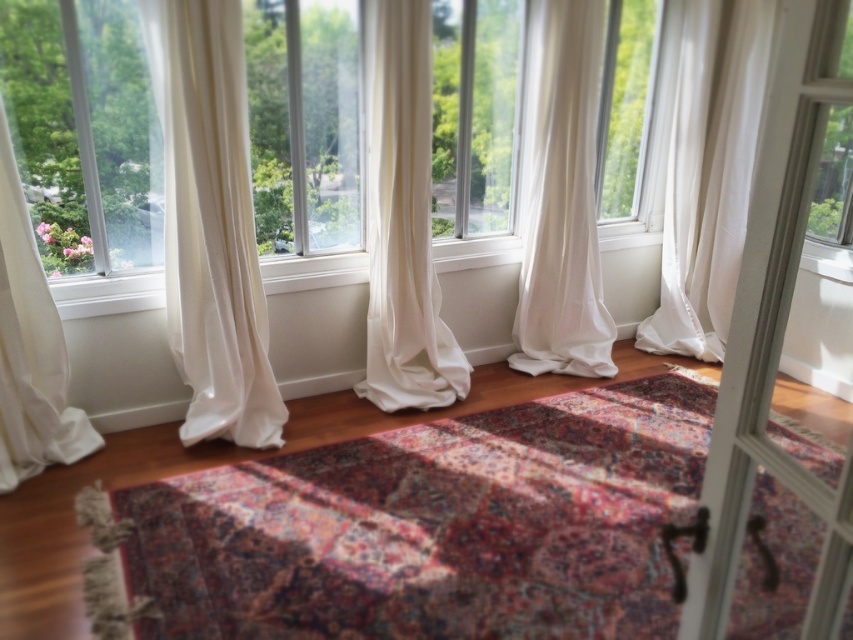
You are a professional decorator planning to place a 30 inch wide decorative shelf between the white sheer curtain at right and the white sheer curtain at center. Based on the space between them, will the shelf fit without overlapping the curtains?

The distance between the white sheer curtain at right and the white sheer curtain at center is 29.23 inches. Since the shelf is 30 inches wide, it is slightly wider than the available space, so the shelf will not fit without overlapping the curtains.

You are standing in the room and want to know which object is shorter between the transparent glass window at left and the sheer white curtain at center. Can you determine this?

The transparent glass window at left has a lesser height compared to the sheer white curtain at center, so the transparent glass window at left is shorter.